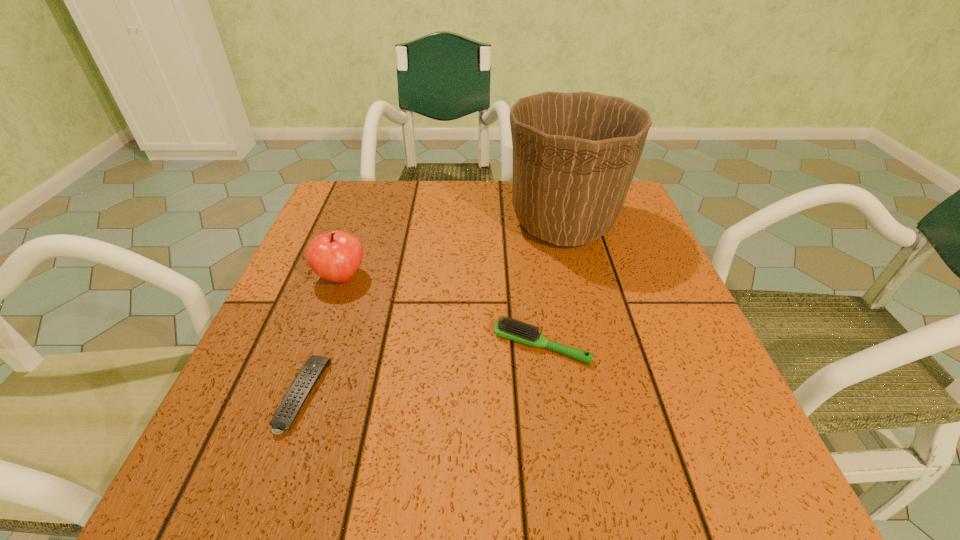
Locate an element on the screen. The width and height of the screenshot is (960, 540). the second closest object to the tallest object is located at coordinates (x=335, y=256).

The height and width of the screenshot is (540, 960). In order to click on vacant space that satisfies the following two spatial constraints: 1. on the back side of the hairbrush; 2. on the right side of the flowerpot in this screenshot , I will do `click(525, 223)`.

Identify the location of free space that satisfies the following two spatial constraints: 1. on the back side of the shortest object; 2. on the left side of the farthest object. (364, 223).

The image size is (960, 540). What are the coordinates of `blank space that satisfies the following two spatial constraints: 1. on the back side of the shortest object; 2. on the right side of the farthest object` in the screenshot? It's located at (364, 223).